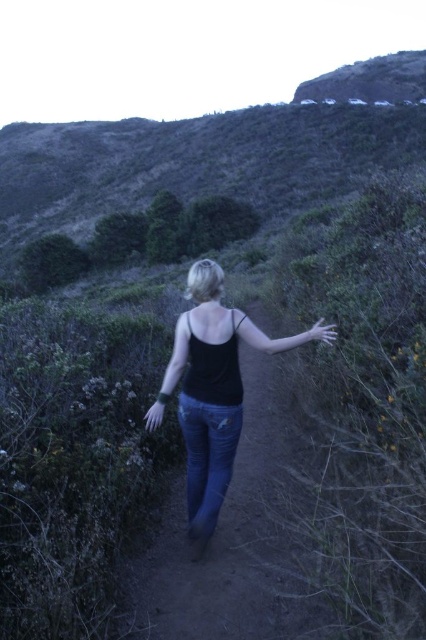
Question: Is black matte tank top at center further to camera compared to denim at center?

Choices:
 (A) no
 (B) yes

Answer: (B)

Question: Which object is farther from the camera taking this photo?

Choices:
 (A) black matte tank top at center
 (B) denim at center

Answer: (A)

Question: In this image, where is black matte tank top at center located relative to denim at center?

Choices:
 (A) above
 (B) below

Answer: (A)

Question: Does black matte tank top at center have a lesser width compared to denim at center?

Choices:
 (A) no
 (B) yes

Answer: (B)